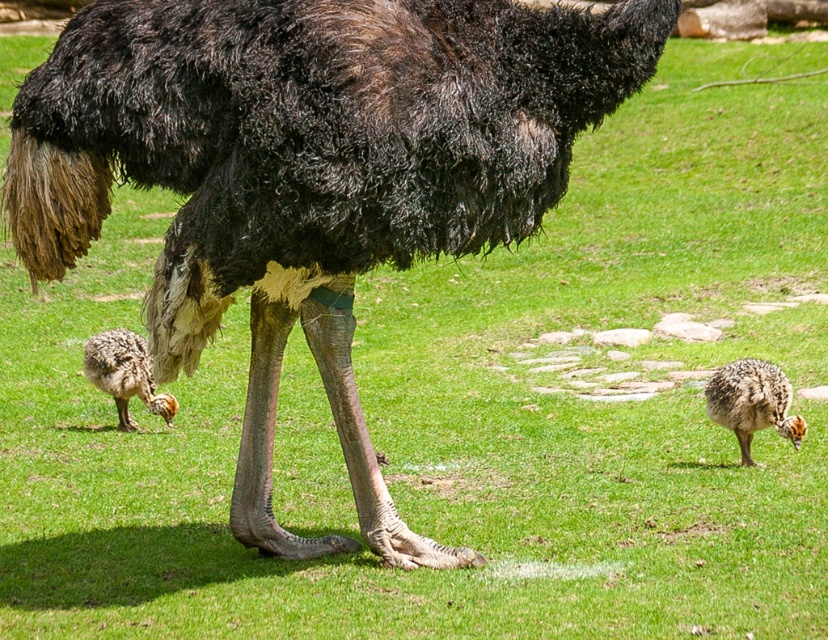
Question: Can you confirm if black feathered ostrich at center is wider than spotted feathered chick at lower right?

Choices:
 (A) no
 (B) yes

Answer: (B)

Question: Which point appears farthest from the camera in this image?

Choices:
 (A) (586, 36)
 (B) (766, 392)
 (C) (123, 420)

Answer: (C)

Question: Among these objects, which one is farthest from the camera?

Choices:
 (A) black feathered ostrich at center
 (B) speckled feathered chick at lower left

Answer: (B)

Question: Can you confirm if black feathered ostrich at center is thinner than spotted feathered chick at lower right?

Choices:
 (A) no
 (B) yes

Answer: (A)

Question: Can you confirm if black feathered ostrich at center is bigger than spotted feathered chick at lower right?

Choices:
 (A) yes
 (B) no

Answer: (A)

Question: Which point appears closest to the camera in this image?

Choices:
 (A) (660, 3)
 (B) (737, 397)
 (C) (133, 426)

Answer: (A)